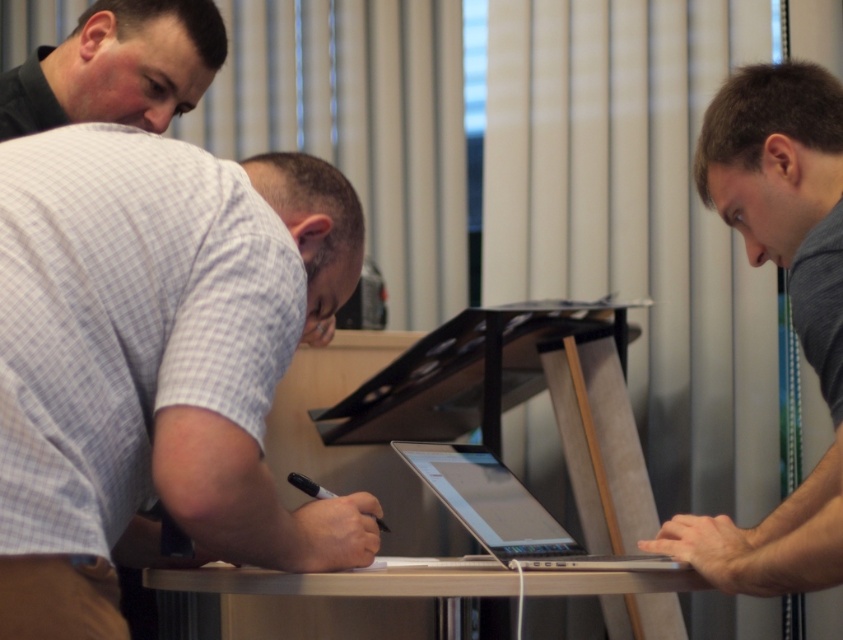
Question: Which object is closer to the camera taking this photo?

Choices:
 (A) matte black easel at center
 (B) white checkered shirt at upper left

Answer: (B)

Question: Does matte black easel at center have a smaller size compared to gray matte laptop at center?

Choices:
 (A) yes
 (B) no

Answer: (B)

Question: Which object is the farthest from the silver metallic table at center?

Choices:
 (A) matte black easel at center
 (B) silver metallic laptop at center

Answer: (A)

Question: Which of the following is the farthest from the observer?

Choices:
 (A) (447, 595)
 (B) (374, 440)

Answer: (B)

Question: Does black shirt at upper left appear over silver metallic table at center?

Choices:
 (A) yes
 (B) no

Answer: (A)

Question: In this image, where is gray matte laptop at center located relative to silver metallic table at center?

Choices:
 (A) above
 (B) below

Answer: (A)